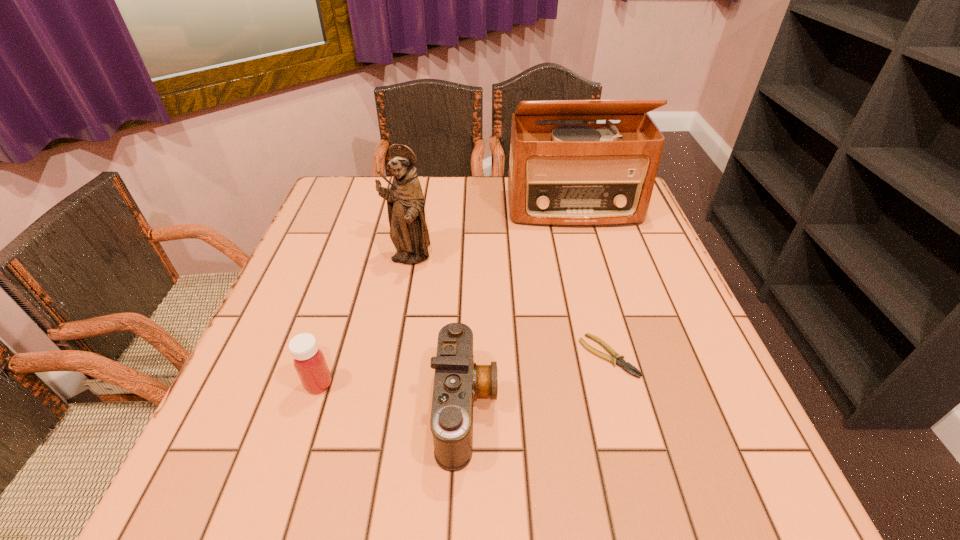
Locate an element on the screen. This screenshot has width=960, height=540. vacant region located on the back of the shortest object is located at coordinates (574, 229).

The width and height of the screenshot is (960, 540). I want to click on object that is at the far edge, so click(x=595, y=174).

Locate an element on the screen. object located at the near edge is located at coordinates (458, 380).

This screenshot has width=960, height=540. I want to click on object present at the left edge, so click(x=309, y=361).

Where is `radio receiver that is at the right edge`? radio receiver that is at the right edge is located at coordinates (595, 174).

In order to click on pliers that is at the right edge in this screenshot , I will do `click(617, 359)`.

This screenshot has width=960, height=540. Identify the location of object that is positioned at the far right corner. (595, 174).

You are a GUI agent. You are given a task and a screenshot of the screen. Output one action in this format:
    pyautogui.click(x=<x>, y=<y>)
    Task: Click on the free space at the far edge of the desktop
    
    Given the screenshot: What is the action you would take?
    pyautogui.click(x=442, y=195)

The image size is (960, 540). What are the coordinates of `vacant point at the near edge` in the screenshot? It's located at (x=641, y=478).

Image resolution: width=960 pixels, height=540 pixels. In the image, there is a desktop. Identify the location of vacant space at the left edge. (307, 319).